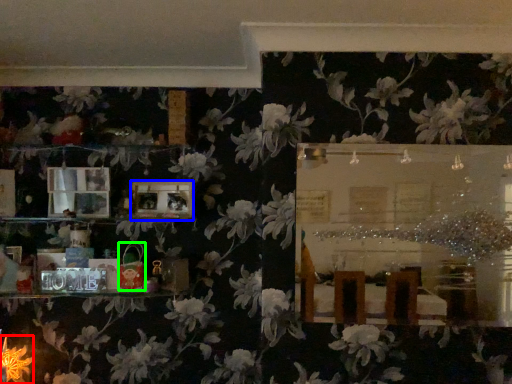
Question: Which object is the farthest from flower (highlighted by a red box)? Choose among these: picture frame (highlighted by a blue box) or toy (highlighted by a green box).

Choices:
 (A) picture frame
 (B) toy

Answer: (A)